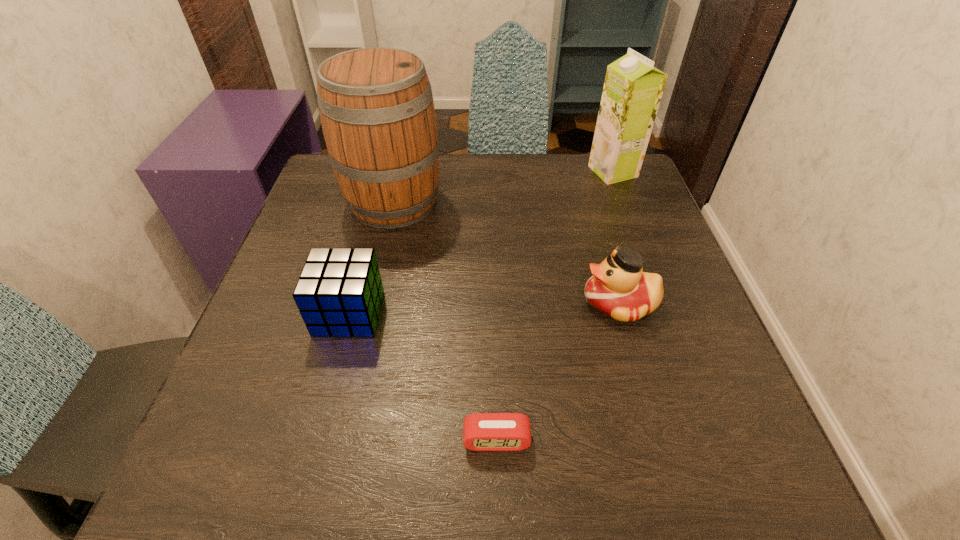
The image size is (960, 540). I want to click on cider, so click(x=376, y=107).

You are a GUI agent. You are given a task and a screenshot of the screen. Output one action in this format:
    pyautogui.click(x=<x>, y=<y>)
    Task: Click on the soya milk
    Image resolution: width=960 pixels, height=540 pixels.
    Given the screenshot: What is the action you would take?
    pyautogui.click(x=633, y=87)

I want to click on duck, so click(619, 289).

The height and width of the screenshot is (540, 960). Find the location of `cube`. cube is located at coordinates (339, 293).

Where is `the nearest object`? This screenshot has height=540, width=960. the nearest object is located at coordinates (481, 431).

The width and height of the screenshot is (960, 540). I want to click on alarm clock, so click(481, 431).

This screenshot has height=540, width=960. I want to click on vacant position located 0.050m on the back of the cider, so click(402, 164).

You are a GUI agent. You are given a task and a screenshot of the screen. Output one action in this format:
    pyautogui.click(x=<x>, y=<y>)
    Task: Click on the free space located 0.320m on the left of the soya milk
    
    Given the screenshot: What is the action you would take?
    pyautogui.click(x=467, y=171)

Locate an element on the screen. The image size is (960, 540). blank space located on the face of the duck is located at coordinates (524, 303).

This screenshot has width=960, height=540. I want to click on vacant space located 0.160m on the face of the duck, so click(497, 303).